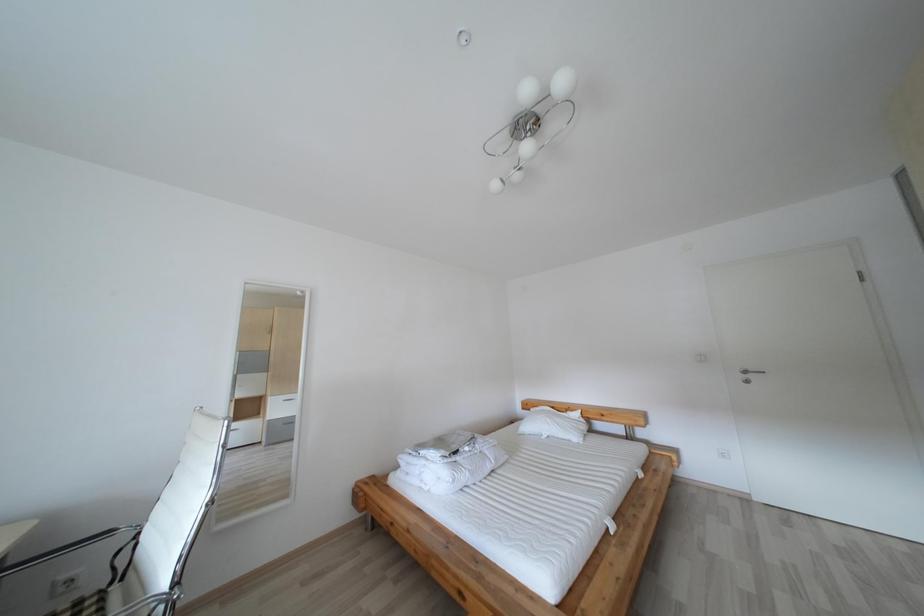
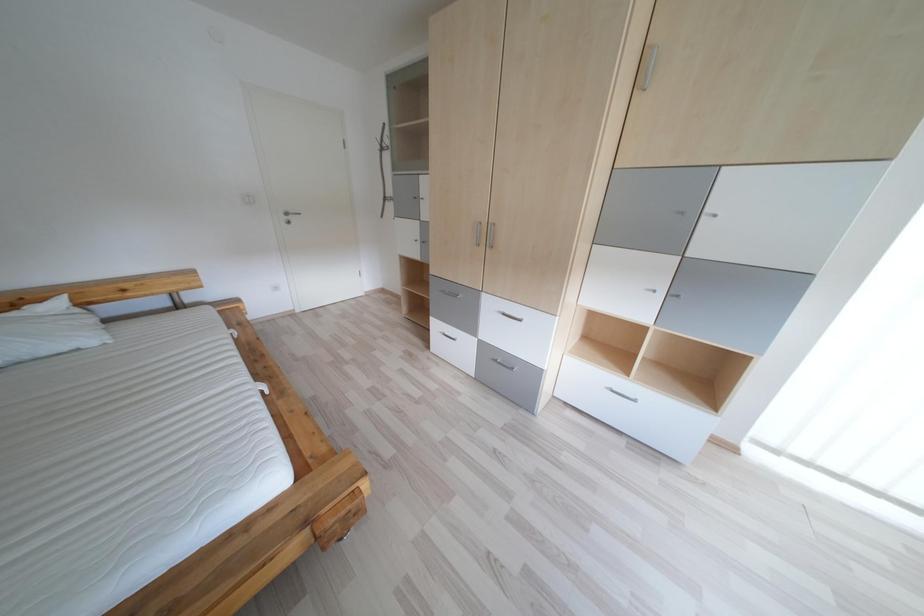
Consider the image. First-person continuous shooting, in which direction is the camera rotating?

The rotation direction of the camera is right-down.